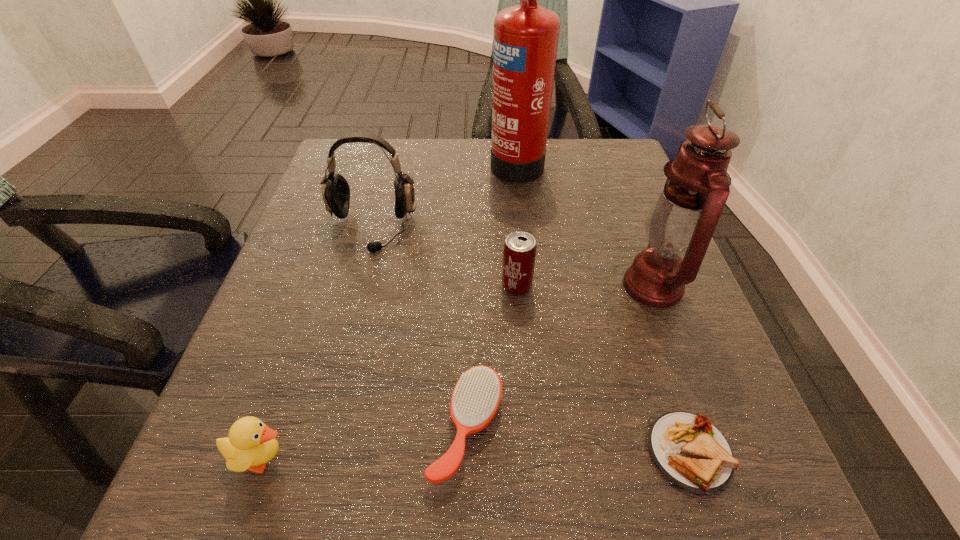
The width and height of the screenshot is (960, 540). Find the location of `hairbrush at the near edge`. hairbrush at the near edge is located at coordinates (476, 397).

You are a GUI agent. You are given a task and a screenshot of the screen. Output one action in this format:
    pyautogui.click(x=<x>, y=<y>)
    Task: Click on the sandwich that is at the near edge
    Image resolution: width=960 pixels, height=540 pixels.
    Given the screenshot: What is the action you would take?
    pyautogui.click(x=690, y=451)

Where is `headset that is at the left edge`? headset that is at the left edge is located at coordinates (335, 189).

Where is `duckling located in the left edge section of the desktop`? Image resolution: width=960 pixels, height=540 pixels. duckling located in the left edge section of the desktop is located at coordinates (251, 444).

Where is `oil lamp that is at the right edge`? This screenshot has width=960, height=540. oil lamp that is at the right edge is located at coordinates (681, 222).

The width and height of the screenshot is (960, 540). What are the coordinates of `sandwich that is at the right edge` in the screenshot? It's located at (690, 451).

Identify the location of object situated at the near left corner. This screenshot has width=960, height=540. (251, 444).

Where is `object located in the near right corner section of the desktop`? The image size is (960, 540). object located in the near right corner section of the desktop is located at coordinates (690, 451).

Where is `free spot at the far edge of the desktop`? The height and width of the screenshot is (540, 960). free spot at the far edge of the desktop is located at coordinates pos(456,188).

You are a GUI agent. You are given a task and a screenshot of the screen. Output one action in this format:
    pyautogui.click(x=<x>, y=<y>)
    Task: Click on the vacant position at the near edge of the desktop
    The height and width of the screenshot is (540, 960).
    Given the screenshot: What is the action you would take?
    [396, 466]